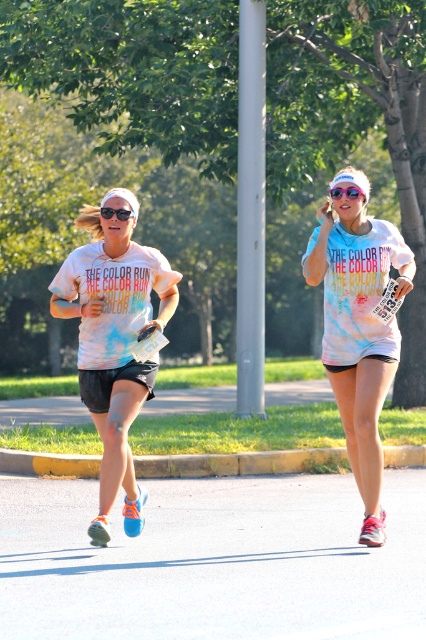
Question: Is tie-dye fabric shirt at center further to the viewer compared to black plastic sunglasses at upper center?

Choices:
 (A) yes
 (B) no

Answer: (A)

Question: Which of the following is the farthest from the observer?

Choices:
 (A) tie-dye cotton shirt at center
 (B) white tie-dye shirt at left
 (C) tie-dye fabric shirt at center
 (D) transparent plastic goggles at upper center

Answer: (C)

Question: Is white tie-dye shirt at left thinner than tie-dye fabric shirt at center?

Choices:
 (A) no
 (B) yes

Answer: (A)

Question: Is white tie-dye shirt at left thinner than black plastic sunglasses at upper center?

Choices:
 (A) yes
 (B) no

Answer: (B)

Question: Which object is positioned farthest from the black plastic sunglasses at upper center?

Choices:
 (A) tie-dye fabric shirt at center
 (B) tie-dye cotton shirt at center
 (C) transparent plastic goggles at upper center
 (D) white tie-dye shirt at left

Answer: (D)

Question: Which point is closer to the camera?

Choices:
 (A) tie-dye cotton shirt at center
 (B) transparent plastic goggles at upper center
 (C) black plastic sunglasses at upper center

Answer: (A)